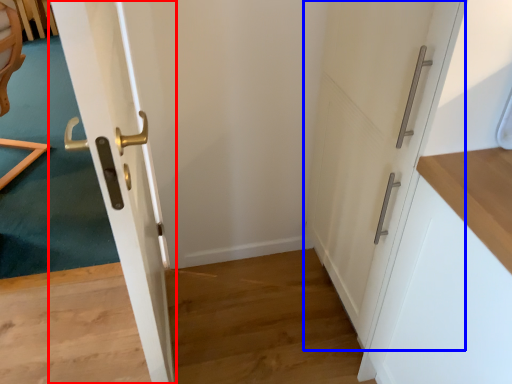
Question: Which point is further to the camera, door (highlighted by a red box) or door (highlighted by a blue box)?

Choices:
 (A) door
 (B) door

Answer: (B)